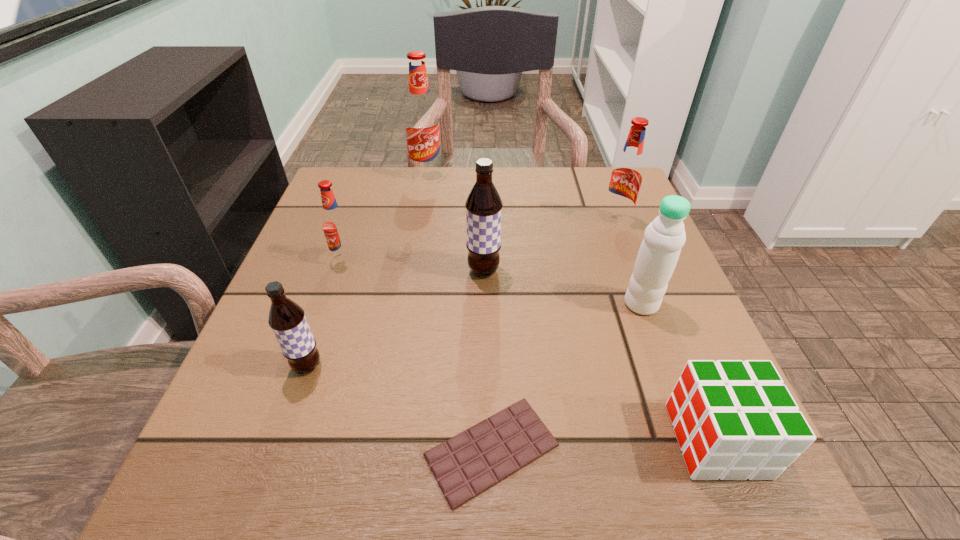
The image size is (960, 540). In order to click on vacant area that lies between the bigger brown root beer and the water bottle in this screenshot , I will do `click(563, 287)`.

In order to click on free space between the shortest object and the farthest object in this screenshot , I will do `click(459, 312)`.

Where is `free space between the tallest object and the brown chocolate bar`? The height and width of the screenshot is (540, 960). free space between the tallest object and the brown chocolate bar is located at coordinates (459, 312).

The image size is (960, 540). What are the coordinates of `empty space that is in between the red cube and the leftmost red root beer` in the screenshot? It's located at (531, 350).

Image resolution: width=960 pixels, height=540 pixels. In order to click on free area in between the brown chocolate bar and the left brown root beer in this screenshot , I will do `click(399, 408)`.

This screenshot has height=540, width=960. In order to click on vacant space that's between the nearest root beer and the smallest red root beer in this screenshot , I will do `click(326, 313)`.

The image size is (960, 540). Find the location of `vacant space that is in between the leftmost red root beer and the nearer brown root beer`. vacant space that is in between the leftmost red root beer and the nearer brown root beer is located at coordinates (326, 313).

At what (x,y) coordinates should I click in order to perform the action: click on unoccupied area between the nearest red root beer and the chocolate bar. Please return your answer as a coordinate pair (x, y). The image size is (960, 540). Looking at the image, I should click on (419, 354).

This screenshot has height=540, width=960. I want to click on the third closest object to the third nearest object, so click(483, 205).

You are a GUI agent. You are given a task and a screenshot of the screen. Output one action in this format:
    pyautogui.click(x=<x>, y=<y>)
    Task: Click on the object that can be found as the second closest to the third root beer from right to left
    
    Given the screenshot: What is the action you would take?
    pyautogui.click(x=483, y=205)